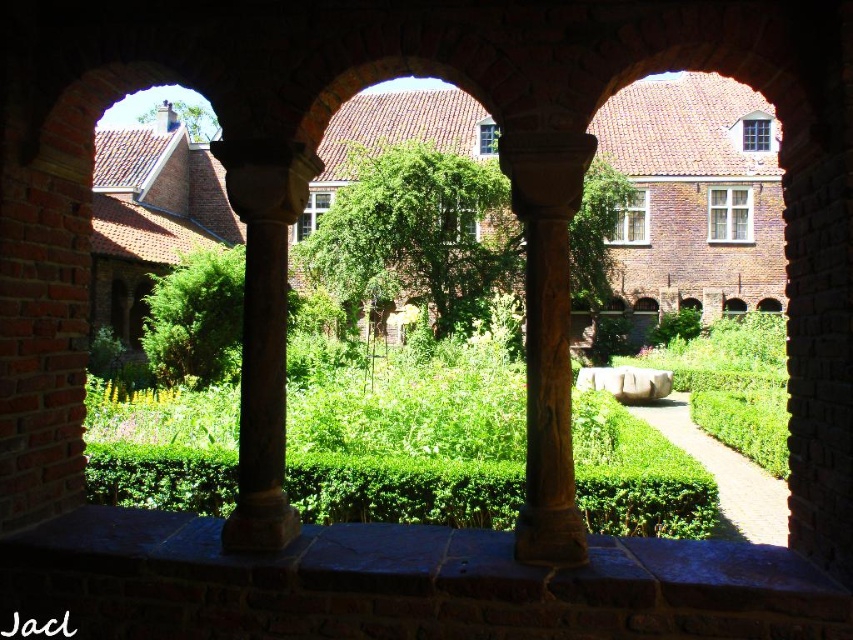
Is point (589, 289) positioned in front of point (543, 385)?

No, it is not.

Is green leafy tree at center thinner than brown carved column at center?

Incorrect, green leafy tree at center's width is not less than brown carved column at center's.

Who is more distant from viewer, [357,268] or [566,481]?

Positioned behind is point [357,268].

I want to click on green leafy tree at center, so click(421, 234).

Which is above, green leafy hedge at center or green leafy tree at center?

Positioned higher is green leafy tree at center.

Which is in front, point (321, 506) or point (405, 182)?

Point (321, 506) is in front.

Is point (755, 314) closer to camera compared to point (488, 252)?

No.

The image size is (853, 640). In order to click on green leafy hedge at center in this screenshot , I will do `click(691, 436)`.

Is green leafy tree at center below green leafy tree at upper left?

Correct, green leafy tree at center is located below green leafy tree at upper left.

Is green leafy tree at center thinner than green leafy tree at upper left?

No, green leafy tree at center is not thinner than green leafy tree at upper left.

Identify the location of green leafy tree at center. (421, 234).